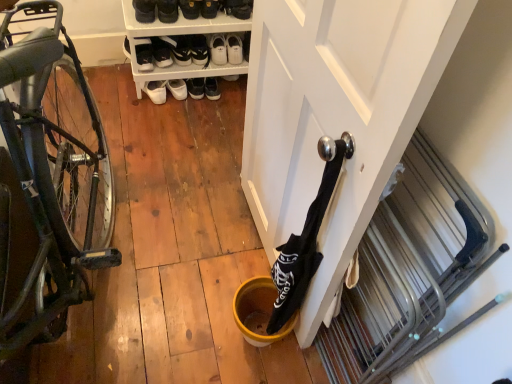
Question: Which direction should I rotate to face black suede shoe at upper center, placed as the third footwear when sorted from left to right, — up or down?

Choices:
 (A) down
 (B) up

Answer: (B)

Question: Does white plastic shoe rack at upper center have a greater height compared to white leather sneakers at upper center, arranged as the sixth footwear when viewed from the left?

Choices:
 (A) no
 (B) yes

Answer: (B)

Question: From a real-world perspective, is white plastic shoe rack at upper center positioned under white leather sneakers at upper center, arranged as the first footwear when viewed from the right, based on gravity?

Choices:
 (A) no
 (B) yes

Answer: (A)

Question: Does white plastic shoe rack at upper center have a greater width compared to white leather sneakers at upper center, arranged as the first footwear when viewed from the right?

Choices:
 (A) yes
 (B) no

Answer: (A)

Question: From a real-world perspective, is white plastic shoe rack at upper center located higher than white leather sneakers at upper center, arranged as the first footwear when viewed from the right?

Choices:
 (A) no
 (B) yes

Answer: (B)

Question: Is white plastic shoe rack at upper center at the right side of white leather sneakers at upper center, arranged as the first footwear when viewed from the right?

Choices:
 (A) no
 (B) yes

Answer: (A)

Question: Is white plastic shoe rack at upper center with white leather sneakers at upper center, arranged as the sixth footwear when viewed from the left?

Choices:
 (A) yes
 (B) no

Answer: (B)

Question: Can you see black fabric wine bottle at center touching white plastic shoe rack at upper center?

Choices:
 (A) no
 (B) yes

Answer: (A)

Question: Does black fabric wine bottle at center have a greater width compared to white plastic shoe rack at upper center?

Choices:
 (A) yes
 (B) no

Answer: (B)

Question: Can white plastic shoe rack at upper center be found inside black fabric wine bottle at center?

Choices:
 (A) no
 (B) yes

Answer: (A)

Question: Can we say black fabric wine bottle at center lies outside white plastic shoe rack at upper center?

Choices:
 (A) no
 (B) yes

Answer: (B)

Question: Is black fabric wine bottle at center smaller than white plastic shoe rack at upper center?

Choices:
 (A) yes
 (B) no

Answer: (A)

Question: Does black fabric wine bottle at center have a lesser width compared to white plastic shoe rack at upper center?

Choices:
 (A) no
 (B) yes

Answer: (B)

Question: Is black fabric wine bottle at center with white leather shoe at upper center, the second shoe when ordered from left to right?

Choices:
 (A) yes
 (B) no

Answer: (B)